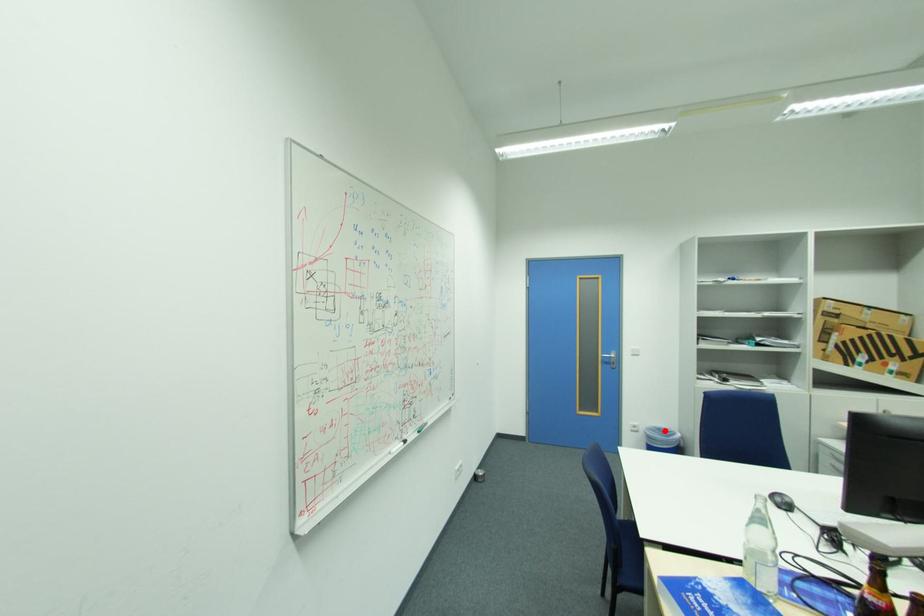
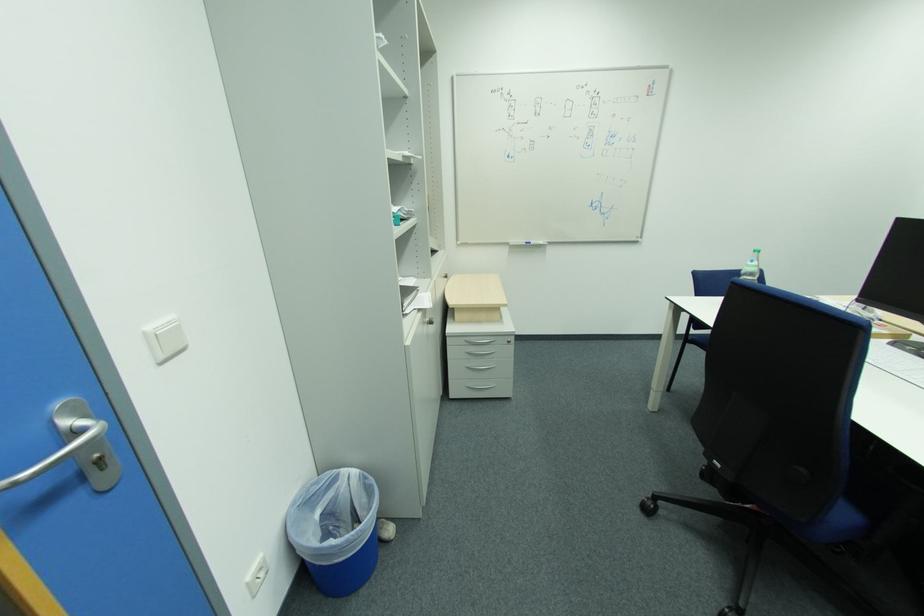
Question: I am providing you with two images of the same scene from different viewpoints. Given a red point in image1, look at the same physical point in image2. Is it:

Choices:
 (A) Closer to the viewpoint
 (B) Farther from the viewpoint

Answer: (B)